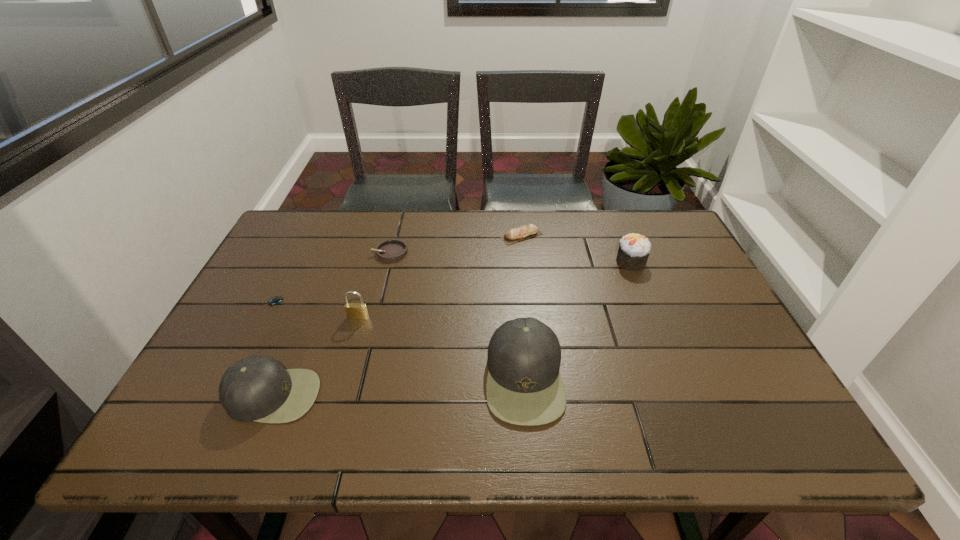
Image resolution: width=960 pixels, height=540 pixels. Identify the location of cap that is positioned at the left edge. point(256,388).

Where is `mouse that is at the left edge`? The height and width of the screenshot is (540, 960). mouse that is at the left edge is located at coordinates (275, 300).

Identify the location of object located at the right edge. (634, 249).

The image size is (960, 540). In order to click on object that is at the near left corner in this screenshot , I will do `click(256, 388)`.

Locate an element on the screen. The width and height of the screenshot is (960, 540). object at the far right corner is located at coordinates (634, 249).

You are a GUI agent. You are given a task and a screenshot of the screen. Output one action in this format:
    pyautogui.click(x=<x>, y=<y>)
    Task: Click on the free space at the far edge of the desktop
    This screenshot has width=960, height=540.
    Given the screenshot: What is the action you would take?
    pyautogui.click(x=617, y=231)

You are a GUI agent. You are given a task and a screenshot of the screen. Output one action in this format:
    pyautogui.click(x=<x>, y=<y>)
    Task: Click on the vacant space at the left edge
    The height and width of the screenshot is (540, 960).
    Given the screenshot: What is the action you would take?
    pyautogui.click(x=272, y=255)

This screenshot has width=960, height=540. In the image, there is a desktop. Find the location of `vacant space at the right edge`. vacant space at the right edge is located at coordinates (690, 311).

At what (x,y) coordinates should I click in order to perform the action: click on free space at the far left corner. Please return your answer as a coordinate pair (x, y). Image resolution: width=960 pixels, height=540 pixels. Looking at the image, I should click on (316, 246).

Locate an element on the screen. Image resolution: width=960 pixels, height=540 pixels. vacant space at the far right corner of the desktop is located at coordinates (676, 252).